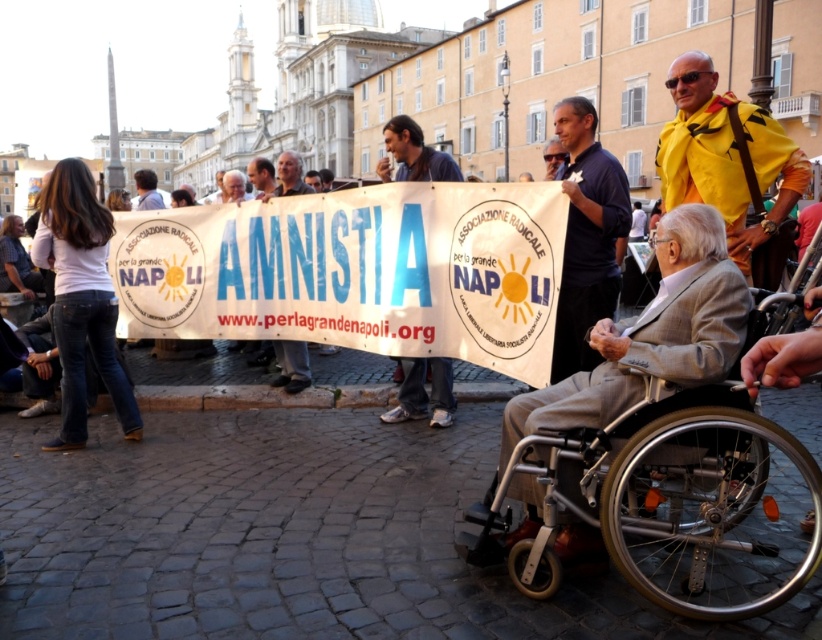
You are a photographer trying to capture a photo of the dark blue shirt at center without the silver metallic wheelchair at lower right blocking the view. Based on their heights, is this possible?

The silver metallic wheelchair at lower right has a lesser height compared to dark blue shirt at center. Therefore, the wheelchair is shorter than the shirt, so the photographer can likely position themselves to capture the shirt without obstruction from the wheelchair.

You are a photographer at the event and want to capture a photo of the dark blue shirt at center and blue jeans at center. Since you want to highlight both subjects equally, which one should you zoom in on more?

The dark blue shirt at center occupies less space than blue jeans at center, so you should zoom in more on the dark blue shirt at center to balance their sizes in the photo.

You are a photographer trying to capture a clear shot of the dark blue shirt at center and the matte black sign at center. Which object should you focus on first to ensure both are in focus, considering their sizes?

The dark blue shirt at center is larger than the matte black sign at center, so focusing on the larger dark blue shirt at center first would help ensure both are in focus.